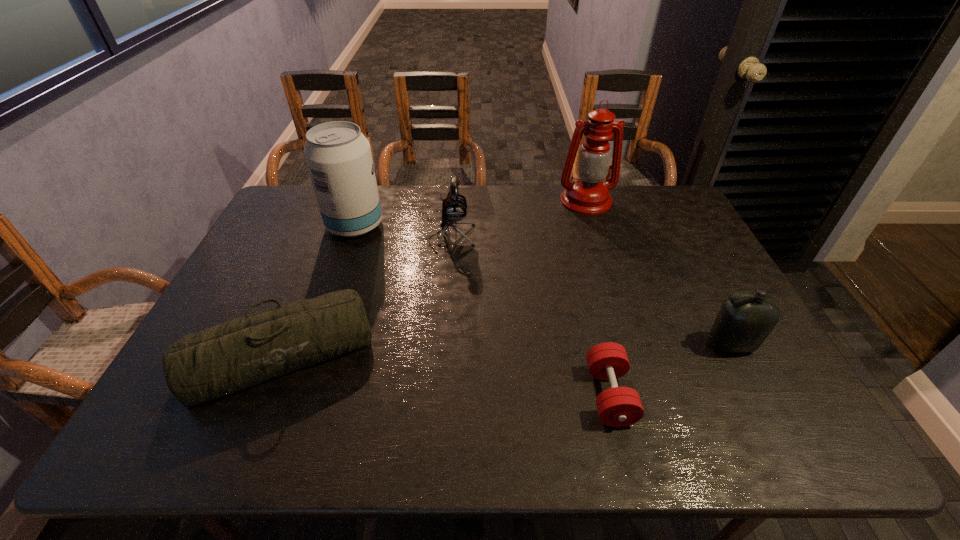
Where is `vacant space at the right edge of the desktop`? The width and height of the screenshot is (960, 540). vacant space at the right edge of the desktop is located at coordinates (727, 368).

What are the coordinates of `vacant space at the far right corner of the desktop` in the screenshot? It's located at (660, 193).

Identify the location of free space at the near right corner of the desktop. (817, 437).

Find the location of a particular element. Image resolution: width=960 pixels, height=540 pixels. vacant area between the oil lamp and the fifth tallest object is located at coordinates (434, 278).

Where is `free space between the dumbbell and the duffel bag`? The width and height of the screenshot is (960, 540). free space between the dumbbell and the duffel bag is located at coordinates (445, 375).

Locate an element on the screen. This screenshot has width=960, height=540. vacant area that lies between the rightmost object and the alcohol is located at coordinates (542, 285).

The height and width of the screenshot is (540, 960). I want to click on vacant space in between the oil lamp and the shortest object, so click(598, 298).

This screenshot has width=960, height=540. Identify the location of free point between the dumbbell and the alcohol. (482, 310).

The height and width of the screenshot is (540, 960). I want to click on empty space that is in between the alcohol and the second shortest object, so click(319, 291).

At what (x,y) coordinates should I click in order to perform the action: click on empty location between the shortest object and the alcohol. Please return your answer as a coordinate pair (x, y). This screenshot has height=540, width=960. Looking at the image, I should click on (482, 310).